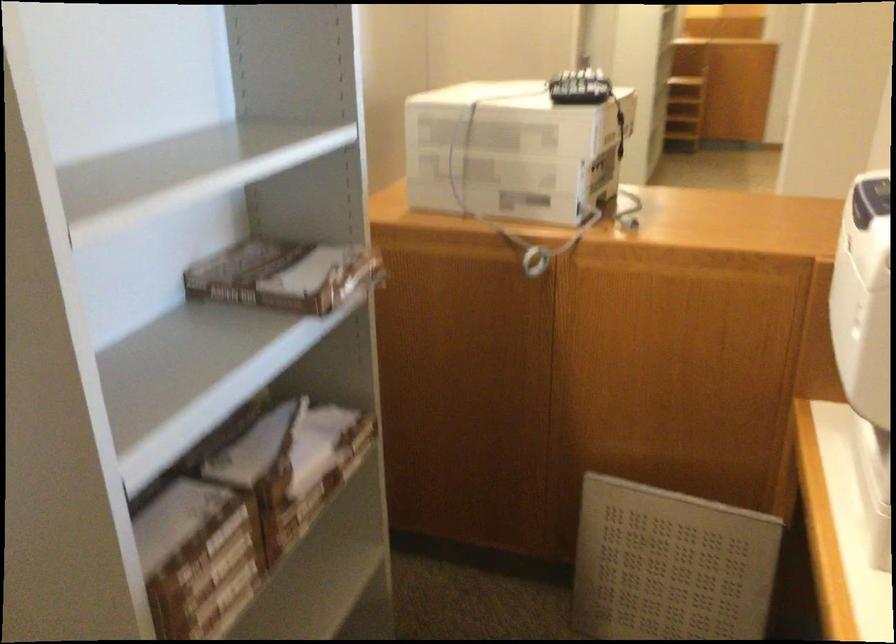
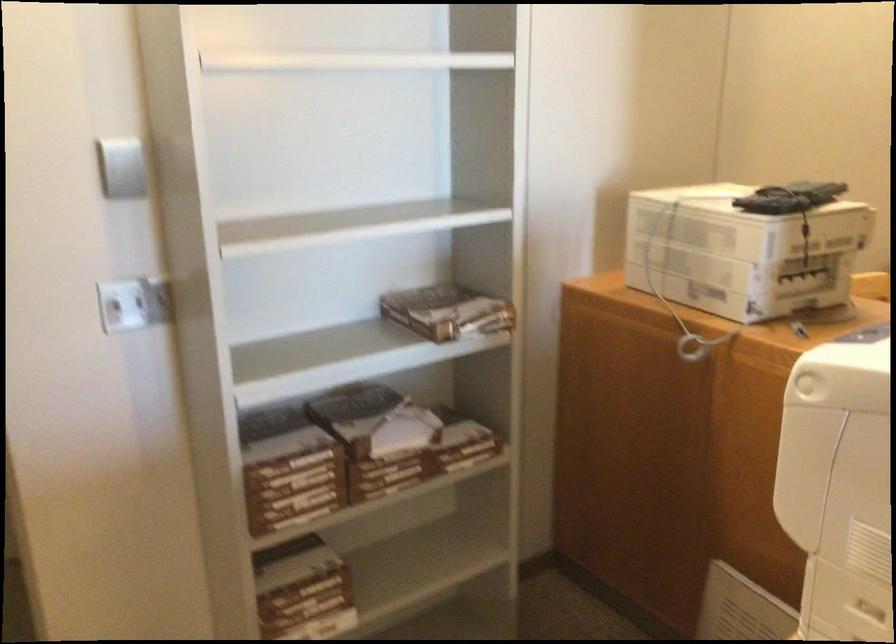
Question: How did the camera likely rotate?

Choices:
 (A) Left
 (B) Right
 (C) Up
 (D) Down

Answer: (A)